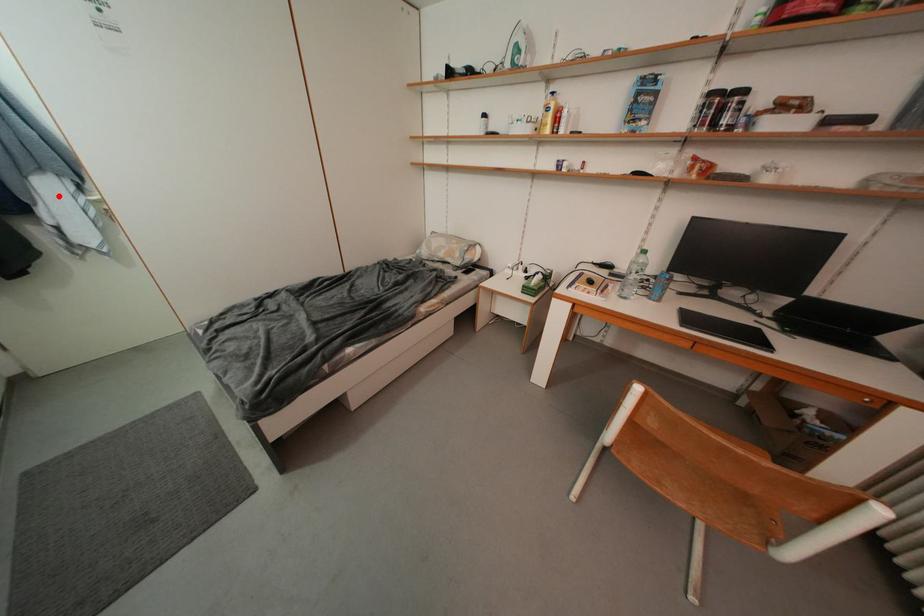
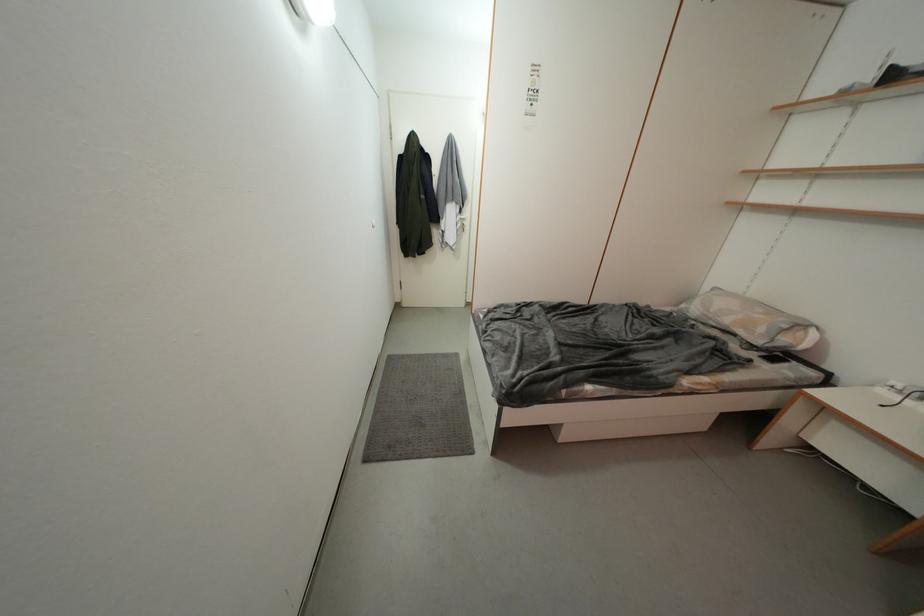
Question: A red point is marked in image1. In image2, is the corresponding 3D point closer to the camera or farther? Reply with the corresponding letter.

Choices:
 (A) The corresponding 3D point is closer.
 (B) The corresponding 3D point is farther.

Answer: (A)